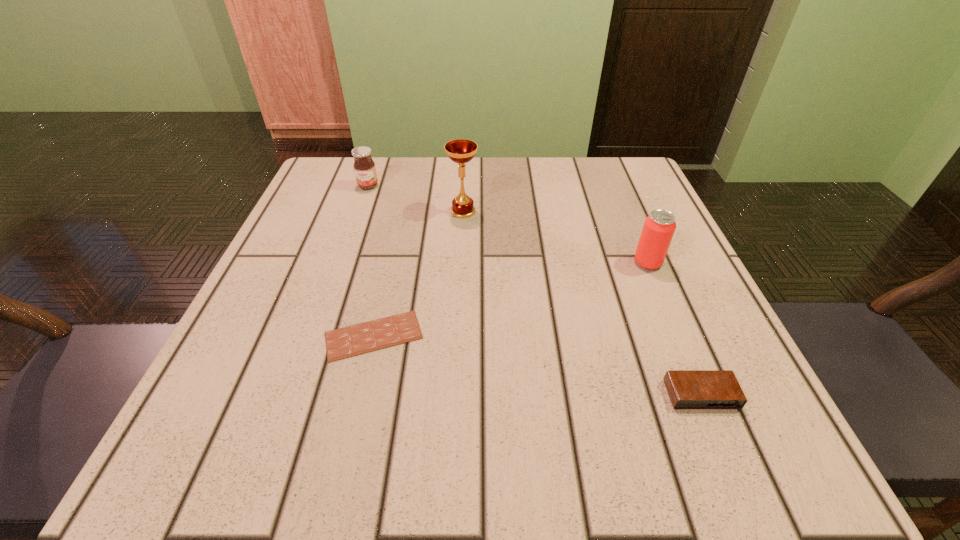
This screenshot has width=960, height=540. I want to click on blank space located on the front of the tallest object, so click(x=459, y=305).

Where is `vacant space situated 0.370m on the left of the beer can`? The height and width of the screenshot is (540, 960). vacant space situated 0.370m on the left of the beer can is located at coordinates (431, 263).

Where is `free space located on the label side of the jam`? free space located on the label side of the jam is located at coordinates (349, 239).

Image resolution: width=960 pixels, height=540 pixels. I want to click on free point located on the front of the chocolate bar, so coord(359,400).

You are a GUI agent. You are given a task and a screenshot of the screen. Output one action in this format:
    pyautogui.click(x=<x>, y=<y>)
    Task: Click on the chalice that is at the far edge
    The width and height of the screenshot is (960, 540).
    Given the screenshot: What is the action you would take?
    pyautogui.click(x=461, y=151)

The height and width of the screenshot is (540, 960). What are the coordinates of `jam that is positioned at the far edge` in the screenshot? It's located at (364, 167).

The width and height of the screenshot is (960, 540). I want to click on jam that is positioned at the left edge, so click(x=364, y=167).

At what (x,y) coordinates should I click in order to perform the action: click on chocolate bar located at the left edge. Please return your answer as a coordinate pair (x, y). This screenshot has width=960, height=540. Looking at the image, I should click on (366, 337).

The image size is (960, 540). Identify the location of beer can that is at the right edge. (659, 227).

Find the location of a particular element. The image size is (960, 540). alarm clock situated at the right edge is located at coordinates (688, 389).